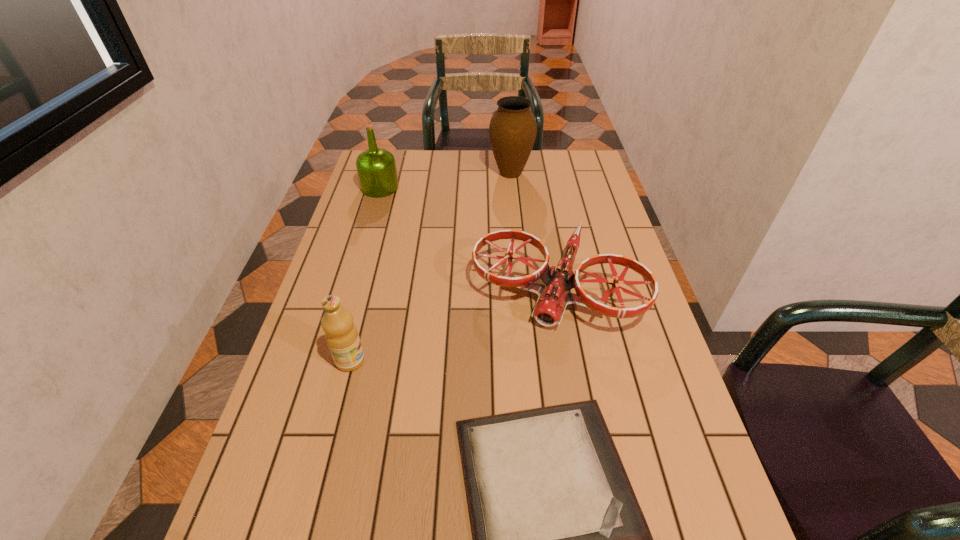
Locate which object ranks fourth in proximity to the drone. Please provide its 2D coordinates. Your answer should be formatted as a tuple, i.e. [(x, y)], where the tuple contains the x and y coordinates of a point satisfying the conditions above.

[(376, 167)]

Identify which object is the closest to the urn. Please provide its 2D coordinates. Your answer should be formatted as a tuple, i.e. [(x, y)], where the tuple contains the x and y coordinates of a point satisfying the conditions above.

[(553, 298)]

I want to click on free spot that satisfies the following two spatial constraints: 1. on the front side of the urn; 2. on the label of the second nearest object, so click(528, 361).

Identify the location of vacant area that satisfies the following two spatial constraints: 1. on the front side of the farther olive oil; 2. on the left side of the drone. (351, 284).